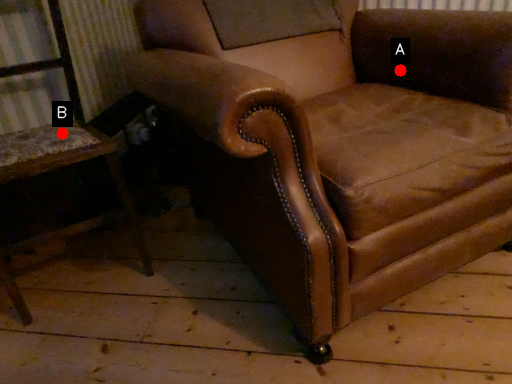
Question: Two points are circled on the image, labeled by A and B beside each circle. Which point is farther from the camera taking this photo?

Choices:
 (A) A is further
 (B) B is further

Answer: (A)